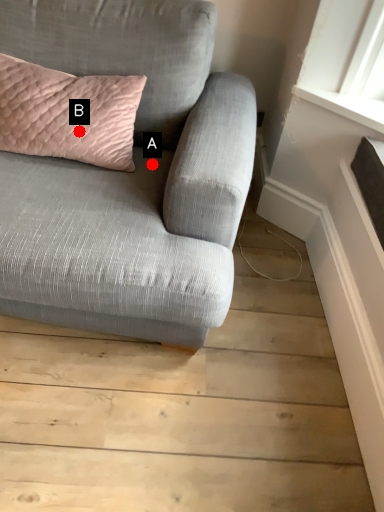
Question: Two points are circled on the image, labeled by A and B beside each circle. Which point is closer to the camera?

Choices:
 (A) A is closer
 (B) B is closer

Answer: (B)